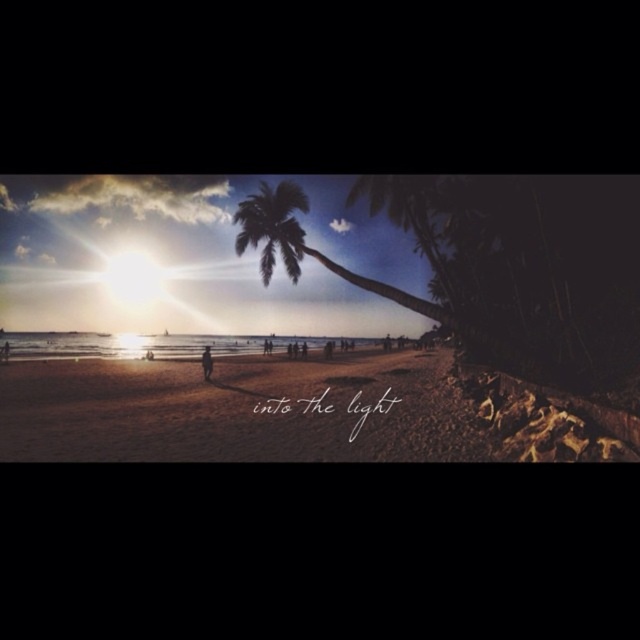
Can you confirm if sandy beach at center is positioned to the right of green leafy palm tree at center?

Incorrect, sandy beach at center is not on the right side of green leafy palm tree at center.

Measure the distance between sandy beach at center and camera.

A distance of 268.94 meters exists between sandy beach at center and camera.

Locate an element on the screen. This screenshot has width=640, height=640. sandy beach at center is located at coordinates (236, 410).

Who is shorter, green leafy palm tree at center or silhouette figure at center?

silhouette figure at center

Is green leafy palm tree at center closer to the viewer compared to silhouette figure at center?

Yes, green leafy palm tree at center is in front of silhouette figure at center.

Where is `green leafy palm tree at center`? This screenshot has width=640, height=640. green leafy palm tree at center is located at coordinates (273, 227).

Is sandy beach at center further to the viewer compared to silhouette figure at center?

No, sandy beach at center is in front of silhouette figure at center.

Which is in front, point (248, 438) or point (205, 372)?

Point (248, 438)

The width and height of the screenshot is (640, 640). I want to click on sandy beach at center, so click(x=236, y=410).